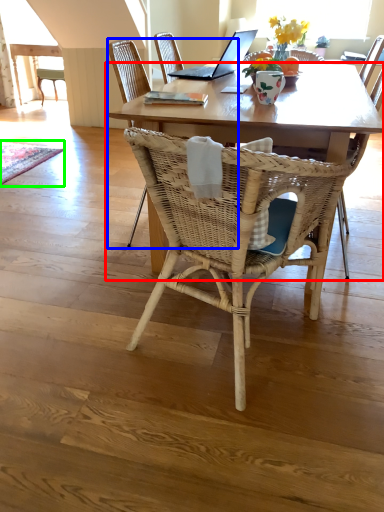
Question: Estimate the real-world distances between objects in this image. Which object is closer to coffee table (highlighted by a red box), chair (highlighted by a blue box) or mat (highlighted by a green box)?

Choices:
 (A) chair
 (B) mat

Answer: (A)